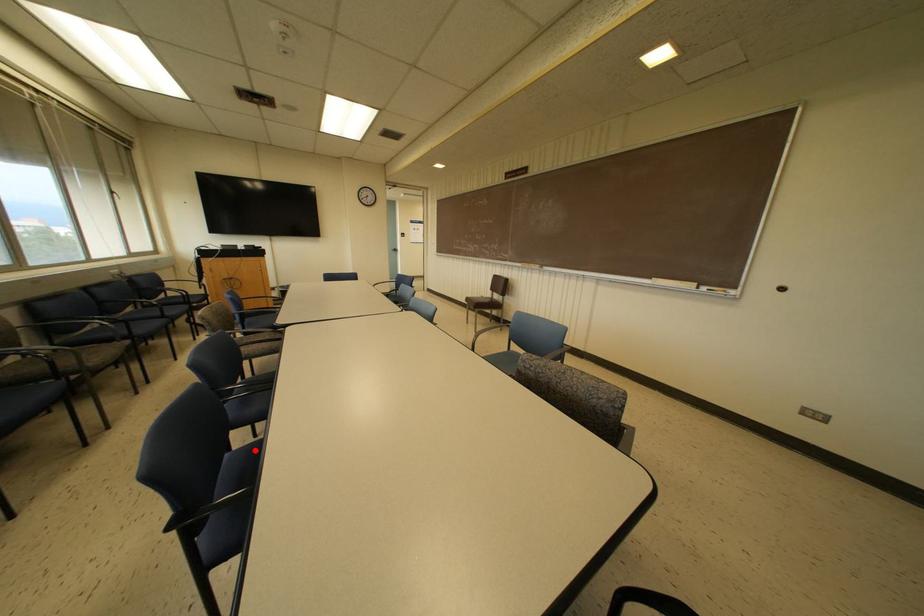
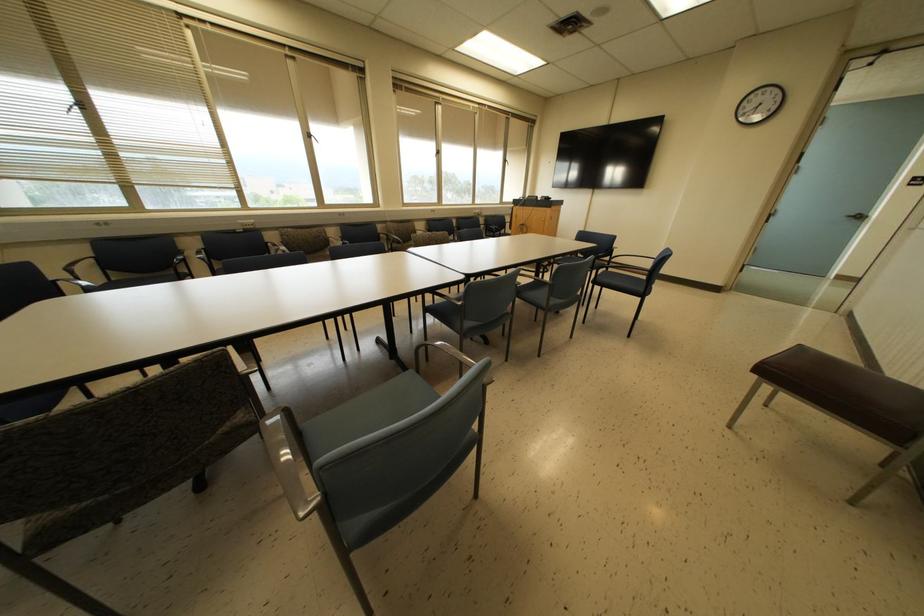
Question: I am providing you with two images of the same scene from different viewpoints. A red point is marked on the first image. Is the red point's position out of view in image 2?

Choices:
 (A) Yes
 (B) No

Answer: (A)